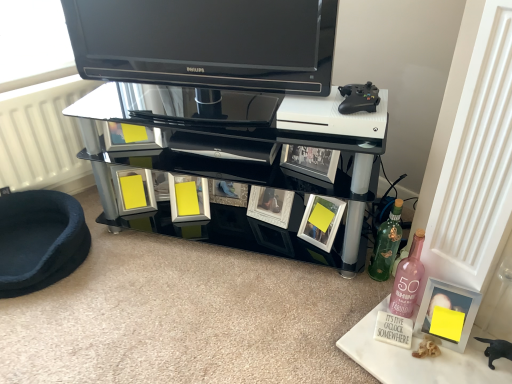
What do you see at coordinates (408, 279) in the screenshot? This screenshot has width=512, height=384. I see `pink glass bottle at lower right, which appears as the first bottle when viewed from the front` at bounding box center [408, 279].

What is the approximate width of black glass shelf at center?

16.13 inches.

Locate an element on the screen. Image resolution: width=512 pixels, height=384 pixels. pink glass bottle at lower right, which appears as the first bottle when viewed from the front is located at coordinates (408, 279).

Is black glossy television at upper center oriented away from green glass bottle at lower right, acting as the 2th bottle starting from the front?

black glossy television at upper center is not turned away from green glass bottle at lower right, acting as the 2th bottle starting from the front.

In the scene shown: From a real-world perspective, who is located lower, black glossy television at upper center or green glass bottle at lower right, acting as the 2th bottle starting from the front?

green glass bottle at lower right, acting as the 2th bottle starting from the front, from a real-world perspective.

How different are the orientations of black glossy television at upper center and green glass bottle at lower right, acting as the 2th bottle starting from the front, in degrees?

The angular difference between black glossy television at upper center and green glass bottle at lower right, acting as the 2th bottle starting from the front, is 6.37 degrees.

From the image's perspective, is black glossy television at upper center located beneath black glass shelf at center?

Actually, black glossy television at upper center appears above black glass shelf at center in the image.

Who is bigger, black glossy television at upper center or black glass shelf at center?

black glass shelf at center is bigger.

Would you say black glossy television at upper center is inside or outside black glass shelf at center?

black glossy television at upper center exists outside the volume of black glass shelf at center.

Considering the positions of objects black glossy television at upper center and black glass shelf at center in the image provided, who is more to the left, black glossy television at upper center or black glass shelf at center?

From the viewer's perspective, black glossy television at upper center appears more on the left side.

Is dark blue plush pet bed at lower left turned away from green glass bottle at lower right, arranged as the first bottle when viewed from the back?

No, dark blue plush pet bed at lower left is not facing the opposite direction of green glass bottle at lower right, arranged as the first bottle when viewed from the back.

Considering the relative sizes of dark blue plush pet bed at lower left and green glass bottle at lower right, arranged as the first bottle when viewed from the back, in the image provided, is dark blue plush pet bed at lower left smaller than green glass bottle at lower right, arranged as the first bottle when viewed from the back,?

Actually, dark blue plush pet bed at lower left might be larger than green glass bottle at lower right, arranged as the first bottle when viewed from the back.

Looking at this image, does dark blue plush pet bed at lower left lie in front of green glass bottle at lower right, acting as the 2th bottle starting from the front?

Yes, it is.

Which is farther, (441,285) or (314,239)?

Positioned behind is point (314,239).

Relative to white glossy picture frame at lower center, the 1th picture frame positioned from the left, is matte silver picture frame at lower right, the 2th picture frame in the top-to-bottom sequence, in front or behind?

Visually, matte silver picture frame at lower right, the 2th picture frame in the top-to-bottom sequence, is located in front of white glossy picture frame at lower center, the 1th picture frame positioned from the left.

From the image's perspective, which one is positioned lower, matte silver picture frame at lower right, placed as the 1th picture frame when sorted from bottom to top, or white glossy picture frame at lower center, acting as the first picture frame starting from the back?

matte silver picture frame at lower right, placed as the 1th picture frame when sorted from bottom to top, from the image's perspective.

Would you say matte silver picture frame at lower right, the 2th picture frame in the top-to-bottom sequence, is inside or outside white glossy picture frame at lower center, the 1th picture frame in the top-to-bottom sequence?

matte silver picture frame at lower right, the 2th picture frame in the top-to-bottom sequence, is spatially situated outside white glossy picture frame at lower center, the 1th picture frame in the top-to-bottom sequence.

From a real-world perspective, is white glossy picture frame at lower center, marked as the second picture frame in a front-to-back arrangement, below green glass bottle at lower right, acting as the 2th bottle starting from the front?

Yes, from a real-world perspective, white glossy picture frame at lower center, marked as the second picture frame in a front-to-back arrangement, is beneath green glass bottle at lower right, acting as the 2th bottle starting from the front.

Consider the image. Considering the relative sizes of white glossy picture frame at lower center, the 1th picture frame in the top-to-bottom sequence, and green glass bottle at lower right, arranged as the first bottle when viewed from the back, in the image provided, is white glossy picture frame at lower center, the 1th picture frame in the top-to-bottom sequence, bigger than green glass bottle at lower right, arranged as the first bottle when viewed from the back,?

No.

Is green glass bottle at lower right, acting as the 2th bottle starting from the front, a part of white glossy picture frame at lower center, placed as the 2th picture frame when sorted from right to left?

Actually, green glass bottle at lower right, acting as the 2th bottle starting from the front, is outside white glossy picture frame at lower center, placed as the 2th picture frame when sorted from right to left.

Consider the image. Which is more to the left, white glossy picture frame at lower center, acting as the first picture frame starting from the back, or green glass bottle at lower right, acting as the 2th bottle starting from the front?

white glossy picture frame at lower center, acting as the first picture frame starting from the back, is more to the left.

Is white glossy picture frame at lower center, placed as the 2th picture frame when sorted from right to left, not within dark blue plush pet bed at lower left?

Absolutely, white glossy picture frame at lower center, placed as the 2th picture frame when sorted from right to left, is external to dark blue plush pet bed at lower left.

Consider the image. From the image's perspective, is white glossy picture frame at lower center, the 1th picture frame in the top-to-bottom sequence, under dark blue plush pet bed at lower left?

Incorrect, from the image's perspective, white glossy picture frame at lower center, the 1th picture frame in the top-to-bottom sequence, is higher than dark blue plush pet bed at lower left.

Who is taller, white glossy picture frame at lower center, the 1th picture frame positioned from the left, or dark blue plush pet bed at lower left?

Standing taller between the two is dark blue plush pet bed at lower left.

Is the position of dark blue plush pet bed at lower left more distant than that of pink glass bottle at lower right, which appears as the first bottle when viewed from the front?

Yes, it is behind pink glass bottle at lower right, which appears as the first bottle when viewed from the front.

Considering the sizes of dark blue plush pet bed at lower left and pink glass bottle at lower right, which appears as the first bottle when viewed from the front, in the image, is dark blue plush pet bed at lower left taller or shorter than pink glass bottle at lower right, which appears as the first bottle when viewed from the front,?

Clearly, dark blue plush pet bed at lower left is shorter compared to pink glass bottle at lower right, which appears as the first bottle when viewed from the front.

From the image's perspective, would you say dark blue plush pet bed at lower left is shown under pink glass bottle at lower right, which appears as the first bottle when viewed from the front?

No.

Is dark blue plush pet bed at lower left bigger or smaller than pink glass bottle at lower right, the second bottle when ordered from back to front?

In the image, dark blue plush pet bed at lower left appears to be larger than pink glass bottle at lower right, the second bottle when ordered from back to front.

From a real-world perspective, which bottle is the 2nd one underneath the black glossy television at upper center? Please provide its 2D coordinates.

[(386, 244)]

I want to click on shelf on the right side of black glossy television at upper center, so click(237, 151).

Estimate the real-world distances between objects in this image. Which object is further from white glossy picture frame at lower center, marked as the second picture frame in a front-to-back arrangement, dark blue plush pet bed at lower left or matte silver picture frame at lower right, the 2th picture frame in the top-to-bottom sequence?

Based on the image, dark blue plush pet bed at lower left appears to be further to white glossy picture frame at lower center, marked as the second picture frame in a front-to-back arrangement.

Looking at this image, looking at the image, which one is located further to green glass bottle at lower right, acting as the 2th bottle starting from the front, black glass shelf at center or matte silver picture frame at lower right, arranged as the first picture frame when viewed from the front?

black glass shelf at center is further to green glass bottle at lower right, acting as the 2th bottle starting from the front.

Looking at the image, which one is located further to matte silver picture frame at lower right, which is the 2th picture frame in left-to-right order, black glossy television at upper center or white glossy picture frame at lower center, marked as the second picture frame in a front-to-back arrangement?

black glossy television at upper center is positioned further to the anchor matte silver picture frame at lower right, which is the 2th picture frame in left-to-right order.

Which object lies nearer to the anchor point matte silver picture frame at lower right, which is the 2th picture frame in left-to-right order, black glossy television at upper center or black glass shelf at center?

Among the two, black glass shelf at center is located nearer to matte silver picture frame at lower right, which is the 2th picture frame in left-to-right order.

When comparing their distances from green glass bottle at lower right, arranged as the first bottle when viewed from the back, does matte silver picture frame at lower right, which is the 2th picture frame from back to front, or black glossy television at upper center seem closer?

The object closer to green glass bottle at lower right, arranged as the first bottle when viewed from the back, is matte silver picture frame at lower right, which is the 2th picture frame from back to front.

Considering their positions, is pink glass bottle at lower right, which appears as the first bottle when viewed from the front, positioned closer to black glossy television at upper center than black glass shelf at center?

black glass shelf at center is positioned closer to the anchor black glossy television at upper center.

When comparing their distances from dark blue plush pet bed at lower left, does matte silver picture frame at lower right, placed as the 1th picture frame when sorted from bottom to top, or pink glass bottle at lower right, which appears as the first bottle when viewed from the front, seem closer?

The object closer to dark blue plush pet bed at lower left is pink glass bottle at lower right, which appears as the first bottle when viewed from the front.

Consider the image. Estimate the real-world distances between objects in this image. Which object is closer to black glossy television at upper center, matte silver picture frame at lower right, the 2th picture frame in the top-to-bottom sequence, or pink glass bottle at lower right, the second bottle when ordered from back to front?

pink glass bottle at lower right, the second bottle when ordered from back to front, is closer to black glossy television at upper center.

At what (x,y) coordinates should I click in order to perform the action: click on shelf situated between dark blue plush pet bed at lower left and green glass bottle at lower right, arranged as the first bottle when viewed from the back, from left to right. Please return your answer as a coordinate pair (x, y). The image size is (512, 384). Looking at the image, I should click on (237, 151).

Where is `picture frame between black glass shelf at center and pink glass bottle at lower right, the second bottle when ordered from back to front, in the horizontal direction`? picture frame between black glass shelf at center and pink glass bottle at lower right, the second bottle when ordered from back to front, in the horizontal direction is located at coordinates pos(321,221).

Locate an element on the screen. The width and height of the screenshot is (512, 384). television situated between dark blue plush pet bed at lower left and white glossy picture frame at lower center, the 1th picture frame in the top-to-bottom sequence, from left to right is located at coordinates (206, 42).

The height and width of the screenshot is (384, 512). What are the coordinates of `picture frame between black glossy television at upper center and green glass bottle at lower right, arranged as the first bottle when viewed from the back, in the horizontal direction` in the screenshot? It's located at (321, 221).